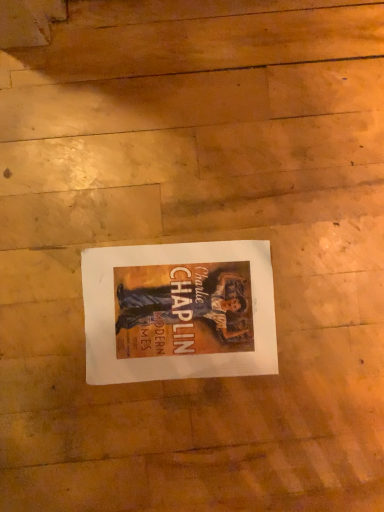
Where is `empty space that is ontop of white paper poster at center`? The height and width of the screenshot is (512, 384). empty space that is ontop of white paper poster at center is located at coordinates 178,314.